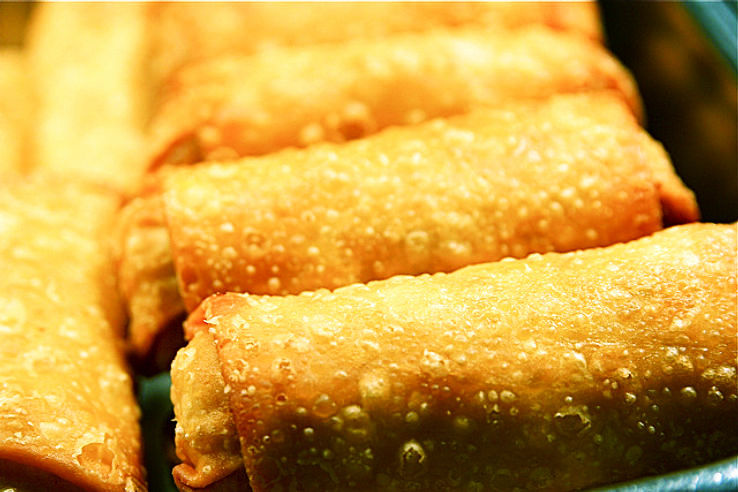
Find the location of a particular element. surface is located at coordinates (154, 445).